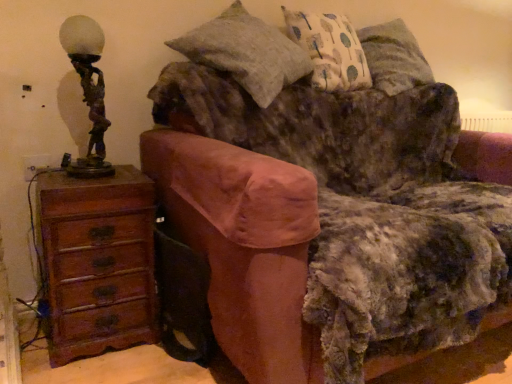
The width and height of the screenshot is (512, 384). What do you see at coordinates (88, 89) in the screenshot?
I see `bronze statue at left` at bounding box center [88, 89].

In order to face brown wood chest of drawers at left, should I rotate leftwards or rightwards?

Turn left by 20.727 degrees to look at brown wood chest of drawers at left.

Locate an element on the screen. Image resolution: width=512 pixels, height=384 pixels. velvet brown couch at center is located at coordinates (369, 210).

Locate an element on the screen. patterned fabric pillow at upper right, acting as the 2th pillow starting from the left is located at coordinates (330, 49).

Between bronze statue at left and velvet brown couch at center, which one is positioned behind?

bronze statue at left.

Considering the relative sizes of bronze statue at left and velvet brown couch at center in the image provided, is bronze statue at left bigger than velvet brown couch at center?

Incorrect, bronze statue at left is not larger than velvet brown couch at center.

Which of these two, bronze statue at left or velvet brown couch at center, stands shorter?

Standing shorter between the two is bronze statue at left.

Considering the relative positions of bronze statue at left and velvet brown couch at center in the image provided, is bronze statue at left to the right of velvet brown couch at center from the viewer's perspective?

Incorrect, bronze statue at left is not on the right side of velvet brown couch at center.

Based on the photo, from the image's perspective, which is below, brown wood chest of drawers at left or bronze statue at left?

brown wood chest of drawers at left.

Is brown wood chest of drawers at left shorter than bronze statue at left?

No, brown wood chest of drawers at left is not shorter than bronze statue at left.

Looking at their sizes, would you say brown wood chest of drawers at left is wider or thinner than bronze statue at left?

brown wood chest of drawers at left is wider than bronze statue at left.

From the picture: From a real-world perspective, is brown wood chest of drawers at left located beneath bronze statue at left?

Yes.

Is textured gray pillow at upper center, the 1th pillow positioned from the left, further to camera compared to velvet brown couch at center?

Yes.

Is textured gray pillow at upper center, the 1th pillow positioned from the left, spatially inside velvet brown couch at center, or outside of it?

textured gray pillow at upper center, the 1th pillow positioned from the left, fits inside velvet brown couch at center.

Is textured gray pillow at upper center, the 2th pillow when ordered from right to left, looking in the opposite direction of velvet brown couch at center?

That's not correct — textured gray pillow at upper center, the 2th pillow when ordered from right to left, is not looking away from velvet brown couch at center.

From the image's perspective, between textured gray pillow at upper center, the 1th pillow positioned from the left, and velvet brown couch at center, which one is located above?

textured gray pillow at upper center, the 1th pillow positioned from the left, appears higher in the image.

Can you confirm if patterned fabric pillow at upper right, acting as the 2th pillow starting from the left, is thinner than brown wood chest of drawers at left?

Correct, the width of patterned fabric pillow at upper right, acting as the 2th pillow starting from the left, is less than that of brown wood chest of drawers at left.

From the image's perspective, which is above, patterned fabric pillow at upper right, acting as the 2th pillow starting from the left, or brown wood chest of drawers at left?

patterned fabric pillow at upper right, acting as the 2th pillow starting from the left.

From a real-world perspective, is patterned fabric pillow at upper right, which ranks as the 1th pillow in right-to-left order, positioned under brown wood chest of drawers at left based on gravity?

No, from a real-world perspective, patterned fabric pillow at upper right, which ranks as the 1th pillow in right-to-left order, is not beneath brown wood chest of drawers at left.

In the image, is patterned fabric pillow at upper right, acting as the 2th pillow starting from the left, positioned in front of or behind brown wood chest of drawers at left?

patterned fabric pillow at upper right, acting as the 2th pillow starting from the left, is behind brown wood chest of drawers at left.

Based on the photo, from the image's perspective, which one is positioned lower, brown wood chest of drawers at left or textured gray pillow at upper center, the 1th pillow positioned from the left?

brown wood chest of drawers at left appears lower in the image.

Who is more distant, brown wood chest of drawers at left or textured gray pillow at upper center, the 2th pillow when ordered from right to left?

brown wood chest of drawers at left.

From a real-world perspective, who is located lower, brown wood chest of drawers at left or textured gray pillow at upper center, the 1th pillow positioned from the left?

In real-world perspective, brown wood chest of drawers at left is lower.

Are brown wood chest of drawers at left and textured gray pillow at upper center, the 2th pillow when ordered from right to left, located far from each other?

No, brown wood chest of drawers at left is not far away from textured gray pillow at upper center, the 2th pillow when ordered from right to left.

Image resolution: width=512 pixels, height=384 pixels. Identify the location of the chest of drawers below the velvet brown couch at center (from the image's perspective). (98, 262).

Considering the positions of objects brown wood chest of drawers at left and velvet brown couch at center in the image provided, who is in front, brown wood chest of drawers at left or velvet brown couch at center?

velvet brown couch at center is more forward.

Considering the sizes of objects brown wood chest of drawers at left and velvet brown couch at center in the image provided, who is bigger, brown wood chest of drawers at left or velvet brown couch at center?

velvet brown couch at center.

Considering the points (47, 263) and (457, 317), which point is in front, point (47, 263) or point (457, 317)?

The point (457, 317) is closer.

From the picture: Can you confirm if patterned fabric pillow at upper right, which ranks as the 1th pillow in right-to-left order, is shorter than textured gray pillow at upper center, the 2th pillow when ordered from right to left?

Indeed, patterned fabric pillow at upper right, which ranks as the 1th pillow in right-to-left order, has a lesser height compared to textured gray pillow at upper center, the 2th pillow when ordered from right to left.

From a real-world perspective, does patterned fabric pillow at upper right, which ranks as the 1th pillow in right-to-left order, sit lower than textured gray pillow at upper center, the 2th pillow when ordered from right to left?

Actually, patterned fabric pillow at upper right, which ranks as the 1th pillow in right-to-left order, is physically above textured gray pillow at upper center, the 2th pillow when ordered from right to left, in the real world.

From the image's perspective, which is below, patterned fabric pillow at upper right, which ranks as the 1th pillow in right-to-left order, or textured gray pillow at upper center, the 2th pillow when ordered from right to left?

From the image's view, textured gray pillow at upper center, the 2th pillow when ordered from right to left, is below.

This screenshot has width=512, height=384. I want to click on table lamp that is behind the velvet brown couch at center, so click(88, 89).

Identify the location of table lamp in front of the brown wood chest of drawers at left. The image size is (512, 384). (88, 89).

When comparing their distances from bronze statue at left, does brown wood chest of drawers at left or patterned fabric pillow at upper right, which ranks as the 1th pillow in right-to-left order, seem closer?

brown wood chest of drawers at left lies closer to bronze statue at left than the other object.

From the image, which object appears to be nearer to velvet brown couch at center, patterned fabric pillow at upper right, which ranks as the 1th pillow in right-to-left order, or brown wood chest of drawers at left?

patterned fabric pillow at upper right, which ranks as the 1th pillow in right-to-left order, lies closer to velvet brown couch at center than the other object.

Based on their spatial positions, is textured gray pillow at upper center, the 2th pillow when ordered from right to left, or velvet brown couch at center further from brown wood chest of drawers at left?

Based on the image, textured gray pillow at upper center, the 2th pillow when ordered from right to left, appears to be further to brown wood chest of drawers at left.

Based on their spatial positions, is bronze statue at left or brown wood chest of drawers at left further from patterned fabric pillow at upper right, which ranks as the 1th pillow in right-to-left order?

Based on the image, brown wood chest of drawers at left appears to be further to patterned fabric pillow at upper right, which ranks as the 1th pillow in right-to-left order.

When comparing their distances from brown wood chest of drawers at left, does velvet brown couch at center or textured gray pillow at upper center, the 1th pillow positioned from the left, seem closer?

velvet brown couch at center.

Consider the image. Looking at the image, which one is located further to brown wood chest of drawers at left, velvet brown couch at center or patterned fabric pillow at upper right, acting as the 2th pillow starting from the left?

Among the two, patterned fabric pillow at upper right, acting as the 2th pillow starting from the left, is located further to brown wood chest of drawers at left.

When comparing their distances from brown wood chest of drawers at left, does bronze statue at left or patterned fabric pillow at upper right, which ranks as the 1th pillow in right-to-left order, seem closer?

bronze statue at left is closer to brown wood chest of drawers at left.

From the image, which object appears to be nearer to bronze statue at left, velvet brown couch at center or brown wood chest of drawers at left?

brown wood chest of drawers at left is closer to bronze statue at left.

Where is `pillow between velvet brown couch at center and patterned fabric pillow at upper right, which ranks as the 1th pillow in right-to-left order, along the z-axis`? This screenshot has width=512, height=384. pillow between velvet brown couch at center and patterned fabric pillow at upper right, which ranks as the 1th pillow in right-to-left order, along the z-axis is located at coordinates (246, 52).

Locate an element on the screen. The width and height of the screenshot is (512, 384). table lamp located between brown wood chest of drawers at left and patterned fabric pillow at upper right, which ranks as the 1th pillow in right-to-left order, in the left-right direction is located at coordinates (88, 89).

You are a GUI agent. You are given a task and a screenshot of the screen. Output one action in this format:
    pyautogui.click(x=<x>, y=<y>)
    Task: Click on the pillow between brown wood chest of drawers at left and patterned fabric pillow at upper right, acting as the 2th pillow starting from the left, in the horizontal direction
    The height and width of the screenshot is (384, 512).
    Given the screenshot: What is the action you would take?
    pyautogui.click(x=246, y=52)

Find the location of a particular element. The image size is (512, 384). table lamp situated between brown wood chest of drawers at left and velvet brown couch at center from left to right is located at coordinates (88, 89).